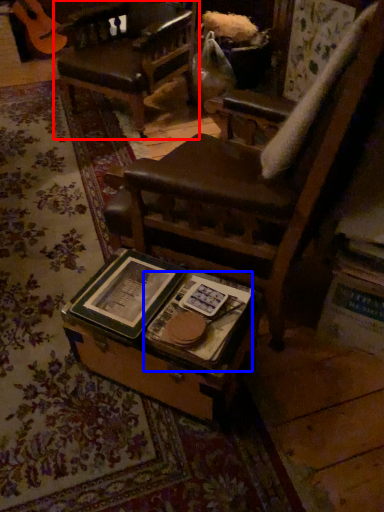
Question: Which object appears closest to the camera in this image, chair (highlighted by a red box) or paperback book (highlighted by a blue box)?

Choices:
 (A) chair
 (B) paperback book

Answer: (B)